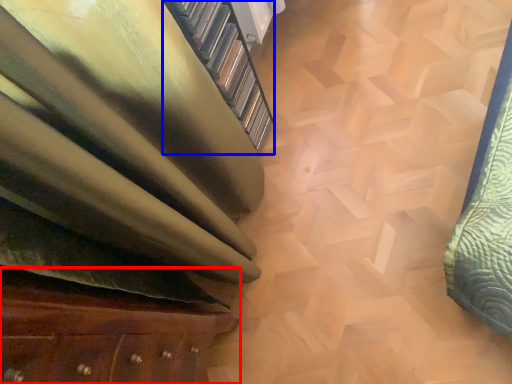
Question: Which of the following is the closest to the observer, furniture (highlighted by a red box) or stairwell (highlighted by a blue box)?

Choices:
 (A) furniture
 (B) stairwell

Answer: (A)